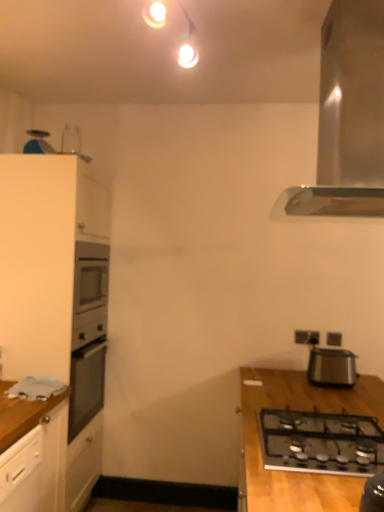
You are a GUI agent. You are given a task and a screenshot of the screen. Output one action in this format:
    pyautogui.click(x=<x>, y=<y>)
    Task: Click on the free space to the left of black plastic toaster at right
    
    Given the screenshot: What is the action you would take?
    pyautogui.click(x=294, y=378)